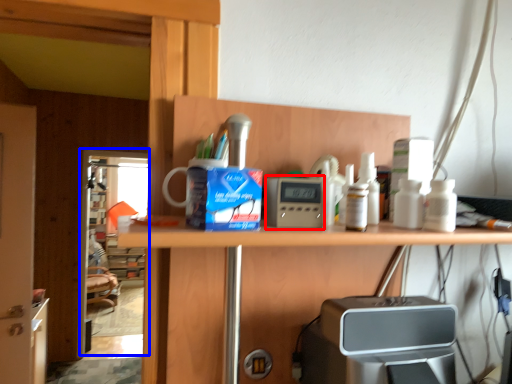
Question: Which object appears closest to the camera in this image, appliance (highlighted by a red box) or screen door (highlighted by a blue box)?

Choices:
 (A) appliance
 (B) screen door

Answer: (A)